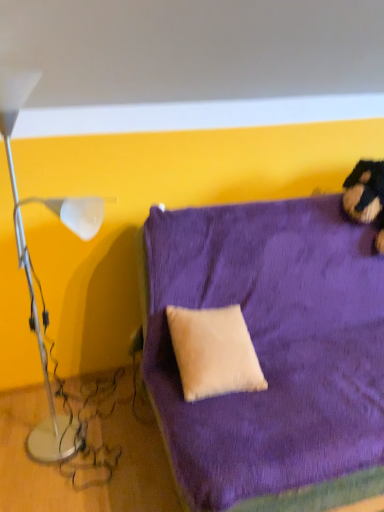
The height and width of the screenshot is (512, 384). Find the location of `beige suede pillow at center`. beige suede pillow at center is located at coordinates (214, 352).

Locate an element on the screen. velvet purple couch at center is located at coordinates (273, 353).

Which is in front, white glossy lamp at left or beige suede pillow at center?

white glossy lamp at left.

Are white glossy lamp at left and beige suede pillow at center beside each other?

No, white glossy lamp at left is not with beige suede pillow at center.

Considering the positions of objects white glossy lamp at left and beige suede pillow at center in the image provided, who is more to the left, white glossy lamp at left or beige suede pillow at center?

Positioned to the left is white glossy lamp at left.

From a real-world perspective, is velvet purple couch at center located higher than beige suede pillow at center?

No.

From the image's perspective, is velvet purple couch at center over beige suede pillow at center?

Indeed, from the image's perspective, velvet purple couch at center is shown above beige suede pillow at center.

Can you confirm if velvet purple couch at center is wider than beige suede pillow at center?

Yes.

Measure the distance between velvet purple couch at center and beige suede pillow at center.

velvet purple couch at center is 8.10 inches from beige suede pillow at center.

Is velvet purple couch at center spatially inside white glossy lamp at left, or outside of it?

velvet purple couch at center lies outside white glossy lamp at left.

From the picture: Could you tell me if velvet purple couch at center is turned towards white glossy lamp at left?

No, velvet purple couch at center is not turned towards white glossy lamp at left.

Which is in front, beige suede pillow at center or velvet purple couch at center?

Positioned in front is velvet purple couch at center.

From a real-world perspective, is beige suede pillow at center located higher than velvet purple couch at center?

Indeed, from a real-world perspective, beige suede pillow at center stands above velvet purple couch at center.

Consider the image. Is beige suede pillow at center oriented towards velvet purple couch at center?

Yes.

Can you confirm if white glossy lamp at left is positioned to the left of velvet purple couch at center?

Yes.

Which is closer to the camera, (57, 419) or (375, 476)?

Point (57, 419) is farther from the camera than point (375, 476).

From the picture: Is white glossy lamp at left smaller than velvet purple couch at center?

Indeed, white glossy lamp at left has a smaller size compared to velvet purple couch at center.

Could velvet purple couch at center be considered to be inside white glossy lamp at left?

No.

Measure the distance from beige suede pillow at center to white glossy lamp at left.

beige suede pillow at center and white glossy lamp at left are 28.39 inches apart.

Which of these two, beige suede pillow at center or white glossy lamp at left, is bigger?

white glossy lamp at left is bigger.

Is point (211, 387) closer to camera compared to point (75, 213)?

That is False.

Does beige suede pillow at center appear on the right side of white glossy lamp at left?

Yes.

Identify the location of lamp located in front of the beige suede pillow at center. This screenshot has width=384, height=512. (30, 266).

You are a GUI agent. You are given a task and a screenshot of the screen. Output one action in this format:
    pyautogui.click(x=<x>, y=<y>)
    Task: Click on the pillow located below the velvet purple couch at center (from the image's perspective)
    The height and width of the screenshot is (512, 384).
    Given the screenshot: What is the action you would take?
    pyautogui.click(x=214, y=352)

Looking at the image, which one is located further to white glossy lamp at left, beige suede pillow at center or velvet purple couch at center?

velvet purple couch at center is further to white glossy lamp at left.

From the image, which object appears to be nearer to velvet purple couch at center, white glossy lamp at left or beige suede pillow at center?

beige suede pillow at center is closer to velvet purple couch at center.

Estimate the real-world distances between objects in this image. Which object is further from beige suede pillow at center, velvet purple couch at center or white glossy lamp at left?

white glossy lamp at left lies further to beige suede pillow at center than the other object.

Looking at the image, which one is located further to white glossy lamp at left, velvet purple couch at center or beige suede pillow at center?

velvet purple couch at center.

Estimate the real-world distances between objects in this image. Which object is further from velvet purple couch at center, beige suede pillow at center or white glossy lamp at left?

Among the two, white glossy lamp at left is located further to velvet purple couch at center.

Estimate the real-world distances between objects in this image. Which object is closer to beige suede pillow at center, white glossy lamp at left or velvet purple couch at center?

velvet purple couch at center.

The width and height of the screenshot is (384, 512). I want to click on pillow between white glossy lamp at left and velvet purple couch at center from left to right, so click(x=214, y=352).